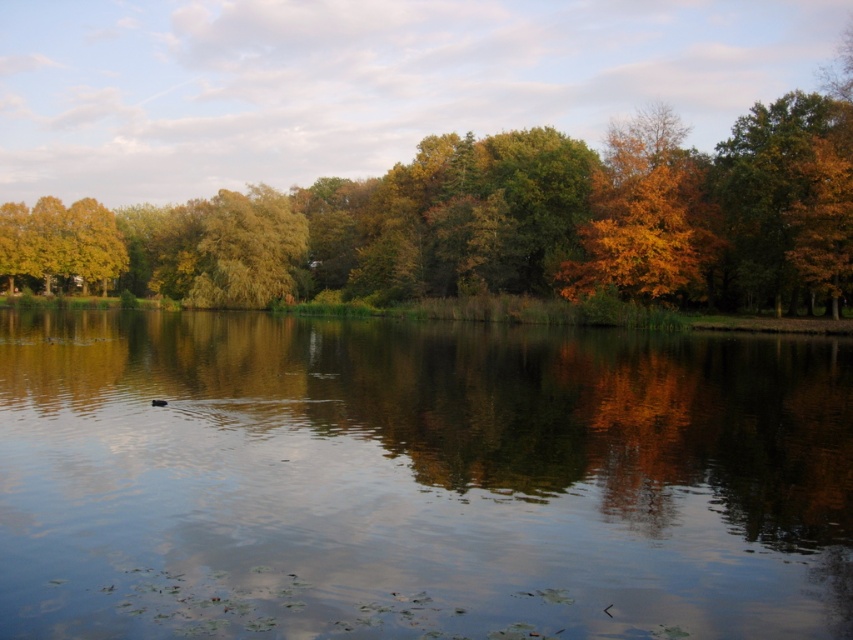
Who is more forward, (318, 500) or (225, 276)?

Point (318, 500)

Can you confirm if transparent water at center is smaller than green leafy tree at center?

Indeed, transparent water at center has a smaller size compared to green leafy tree at center.

Which is in front, point (16, 596) or point (300, 216)?

Point (16, 596) is more forward.

You are a GUI agent. You are given a task and a screenshot of the screen. Output one action in this format:
    pyautogui.click(x=<x>, y=<y>)
    Task: Click on the transparent water at center
    The width and height of the screenshot is (853, 640).
    Given the screenshot: What is the action you would take?
    pyautogui.click(x=416, y=480)